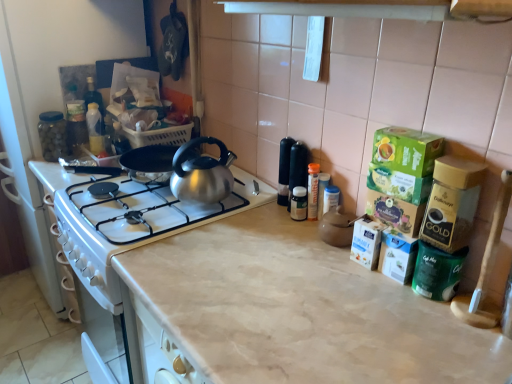
The width and height of the screenshot is (512, 384). What do you see at coordinates (300, 310) in the screenshot?
I see `beige marble countertop at center` at bounding box center [300, 310].

The width and height of the screenshot is (512, 384). I want to click on transparent glass jar at left, positioned as the first appliance in top-to-bottom order, so [53, 135].

Considering the sizes of transparent glass jar at left, which ranks as the 2th appliance in right-to-left order, and green matte coffee container at right, which is counted as the 1th appliance, starting from the front, in the image, is transparent glass jar at left, which ranks as the 2th appliance in right-to-left order, wider or thinner than green matte coffee container at right, which is counted as the 1th appliance, starting from the front,?

Clearly, transparent glass jar at left, which ranks as the 2th appliance in right-to-left order, has less width compared to green matte coffee container at right, which is counted as the 1th appliance, starting from the front.

Is transparent glass jar at left, placed as the first appliance when sorted from left to right, not close to green matte coffee container at right, which is counted as the 1th appliance, starting from the front?

Yes, transparent glass jar at left, placed as the first appliance when sorted from left to right, and green matte coffee container at right, which is counted as the 1th appliance, starting from the front, are located far from each other.

Is transparent glass jar at left, positioned as the first appliance in top-to-bottom order, further to camera compared to green matte coffee container at right, the 2th appliance positioned from the top?

Yes, it is.

Is green matte coffee container at right, which is counted as the 1th appliance, starting from the front, aimed at beige marble countertop at center?

No, green matte coffee container at right, which is counted as the 1th appliance, starting from the front, is not oriented towards beige marble countertop at center.

Considering the relative sizes of green matte coffee container at right, which is counted as the 1th appliance, starting from the front, and beige marble countertop at center in the image provided, is green matte coffee container at right, which is counted as the 1th appliance, starting from the front, smaller than beige marble countertop at center?

Indeed, green matte coffee container at right, which is counted as the 1th appliance, starting from the front, has a smaller size compared to beige marble countertop at center.

Considering the positions of points (422, 284) and (279, 269), is point (422, 284) closer to camera compared to point (279, 269)?

Yes, it is in front of point (279, 269).

Which of these two, green matte coffee container at right, which is the first appliance in right-to-left order, or beige marble countertop at center, stands taller?

beige marble countertop at center.

You are a GUI agent. You are given a task and a screenshot of the screen. Output one action in this format:
    pyautogui.click(x=<x>, y=<y>)
    Task: Click on the countertop beneath the transparent glass jar at left, positioned as the first appliance in top-to-bottom order (from a real-world perspective)
    Image resolution: width=512 pixels, height=384 pixels.
    Given the screenshot: What is the action you would take?
    pyautogui.click(x=300, y=310)

Which object is closer to the camera taking this photo, beige marble countertop at center or transparent glass jar at left, positioned as the first appliance in top-to-bottom order?

beige marble countertop at center is closer to the camera.

How many degrees apart are the facing directions of beige marble countertop at center and transparent glass jar at left, placed as the first appliance when sorted from left to right?

The angle between the facing direction of beige marble countertop at center and the facing direction of transparent glass jar at left, placed as the first appliance when sorted from left to right, is 1.17 degrees.

Is the surface of beige marble countertop at center in direct contact with transparent glass jar at left, the 1th appliance when ordered from back to front?

beige marble countertop at center and transparent glass jar at left, the 1th appliance when ordered from back to front, are clearly separated.

Which point is more distant from viewer, (64, 155) or (387, 343)?

Positioned behind is point (64, 155).

From the image's perspective, is transparent glass jar at left, the second appliance positioned from the front, above or below beige marble countertop at center?

Based on their image positions, transparent glass jar at left, the second appliance positioned from the front, is located above beige marble countertop at center.

Would you say transparent glass jar at left, positioned as the first appliance in top-to-bottom order, is to the left or to the right of beige marble countertop at center in the picture?

transparent glass jar at left, positioned as the first appliance in top-to-bottom order, is to the left of beige marble countertop at center.

Is transparent glass jar at left, positioned as the 2th appliance in bottom-to-top order, a part of green matte coffee container at right, which is the first appliance in right-to-left order?

Actually, transparent glass jar at left, positioned as the 2th appliance in bottom-to-top order, is outside green matte coffee container at right, which is the first appliance in right-to-left order.

Between green matte coffee container at right, which is the first appliance in right-to-left order, and transparent glass jar at left, positioned as the 2th appliance in bottom-to-top order, which one is positioned behind?

Positioned behind is transparent glass jar at left, positioned as the 2th appliance in bottom-to-top order.

Is green matte coffee container at right, which ranks as the 2th appliance in left-to-right order, to the left of transparent glass jar at left, which ranks as the 2th appliance in right-to-left order, from the viewer's perspective?

No.

Based on their sizes in the image, would you say beige marble countertop at center is bigger or smaller than green matte coffee container at right, the 2th appliance positioned from the top?

In the image, beige marble countertop at center appears to be larger than green matte coffee container at right, the 2th appliance positioned from the top.

From a real-world perspective, who is located lower, beige marble countertop at center or green matte coffee container at right, the 2th appliance positioned from the top?

beige marble countertop at center is physically lower.

Is beige marble countertop at center not within green matte coffee container at right, which ranks as the 2th appliance in left-to-right order?

Absolutely, beige marble countertop at center is external to green matte coffee container at right, which ranks as the 2th appliance in left-to-right order.

Between beige marble countertop at center and green matte coffee container at right, the 2th appliance positioned from the top, which one appears on the right side from the viewer's perspective?

green matte coffee container at right, the 2th appliance positioned from the top.

Where is `appliance below the transparent glass jar at left, which ranks as the 2th appliance in right-to-left order (from a real-world perspective)`? appliance below the transparent glass jar at left, which ranks as the 2th appliance in right-to-left order (from a real-world perspective) is located at coordinates (437, 272).

Identify the location of countertop located in front of the green matte coffee container at right, positioned as the 1th appliance in bottom-to-top order. (300, 310).

When comparing their distances from transparent glass jar at left, the second appliance positioned from the front, does beige marble countertop at center or green matte coffee container at right, which ranks as the 2th appliance in left-to-right order, seem closer?

beige marble countertop at center is closer to transparent glass jar at left, the second appliance positioned from the front.

Looking at the image, which one is located further to green matte coffee container at right, positioned as the 1th appliance in bottom-to-top order, transparent glass jar at left, positioned as the first appliance in top-to-bottom order, or beige marble countertop at center?

transparent glass jar at left, positioned as the first appliance in top-to-bottom order, is further to green matte coffee container at right, positioned as the 1th appliance in bottom-to-top order.

Which object lies further to the anchor point transparent glass jar at left, the second appliance positioned from the front, green matte coffee container at right, the 2th appliance positioned from the top, or beige marble countertop at center?

Among the two, green matte coffee container at right, the 2th appliance positioned from the top, is located further to transparent glass jar at left, the second appliance positioned from the front.

Which object lies nearer to the anchor point green matte coffee container at right, the 2th appliance positioned from the top, beige marble countertop at center or transparent glass jar at left, placed as the first appliance when sorted from left to right?

beige marble countertop at center.

Estimate the real-world distances between objects in this image. Which object is further from beige marble countertop at center, transparent glass jar at left, positioned as the 2th appliance in bottom-to-top order, or green matte coffee container at right, which is counted as the 1th appliance, starting from the front?

transparent glass jar at left, positioned as the 2th appliance in bottom-to-top order, is positioned further to the anchor beige marble countertop at center.

Considering their positions, is green matte coffee container at right, which ranks as the 2th appliance in left-to-right order, positioned further to beige marble countertop at center than transparent glass jar at left, placed as the first appliance when sorted from left to right?

transparent glass jar at left, placed as the first appliance when sorted from left to right, is positioned further to the anchor beige marble countertop at center.

Where is `countertop between transparent glass jar at left, positioned as the first appliance in top-to-bottom order, and green matte coffee container at right, positioned as the 1th appliance in bottom-to-top order, from left to right`? The image size is (512, 384). countertop between transparent glass jar at left, positioned as the first appliance in top-to-bottom order, and green matte coffee container at right, positioned as the 1th appliance in bottom-to-top order, from left to right is located at coordinates (300, 310).